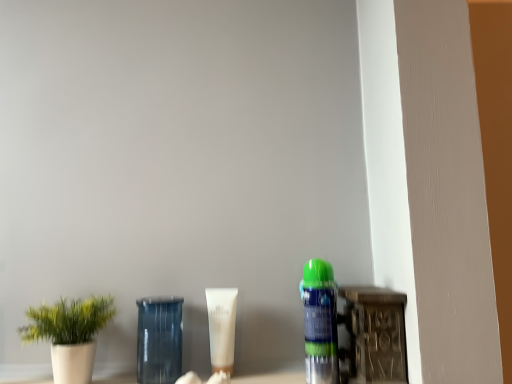
What is the approximate width of transparent glass jar at center?

The width of transparent glass jar at center is 8.79 centimeters.

Image resolution: width=512 pixels, height=384 pixels. What do you see at coordinates (320, 322) in the screenshot?
I see `green matte spray can at right` at bounding box center [320, 322].

Describe the element at coordinates (69, 334) in the screenshot. I see `white matte plant pot at left` at that location.

Identify the location of transparent glass jar at center. The image size is (512, 384). (159, 339).

From the picture: Is green matte spray can at right inside the boundaries of transparent glass jar at center, or outside?

green matte spray can at right cannot be found inside transparent glass jar at center.

From a real-world perspective, between green matte spray can at right and transparent glass jar at center, who is vertically higher?

From a 3D spatial view, green matte spray can at right is above.

Identify the location of glass vase lying on the left of green matte spray can at right. The height and width of the screenshot is (384, 512). (159, 339).

In the scene shown: Is green matte spray can at right taller than transparent glass jar at center?

Indeed, green matte spray can at right has a greater height compared to transparent glass jar at center.

Does white matte plant pot at left come in front of transparent glass jar at center?

Yes, it is.

Is white matte plant pot at left wider or thinner than transparent glass jar at center?

Considering their sizes, white matte plant pot at left looks broader than transparent glass jar at center.

Between white matte plant pot at left and transparent glass jar at center, which one appears on the right side from the viewer's perspective?

transparent glass jar at center is more to the right.

The width and height of the screenshot is (512, 384). Identify the location of glass vase that is on the right side of white matte plant pot at left. (159, 339).

Can green matte spray can at right be found inside white matte plant pot at left?

That's incorrect, green matte spray can at right is not inside white matte plant pot at left.

Which is behind, point (60, 320) or point (318, 258)?

The point (318, 258) is more distant.

Can you confirm if white matte plant pot at left is bigger than green matte spray can at right?

Yes, white matte plant pot at left is bigger than green matte spray can at right.

Is white matte plant pot at left next to green matte spray can at right?

No, white matte plant pot at left is not touching green matte spray can at right.

From their relative heights in the image, would you say transparent glass jar at center is taller or shorter than white matte plant pot at left?

Clearly, transparent glass jar at center is taller compared to white matte plant pot at left.

Is the position of transparent glass jar at center more distant than that of white matte plant pot at left?

Yes.

Can you confirm if transparent glass jar at center is positioned to the right of white matte plant pot at left?

Correct, you'll find transparent glass jar at center to the right of white matte plant pot at left.

Is transparent glass jar at center positioned beyond the bounds of white matte plant pot at left?

Yes, transparent glass jar at center is not within white matte plant pot at left.

Does white matte tube at center touch white matte plant pot at left?

There is a gap between white matte tube at center and white matte plant pot at left.

From the image's perspective, does white matte tube at center appear lower than white matte plant pot at left?

Incorrect, from the image's perspective, white matte tube at center is higher than white matte plant pot at left.

Is white matte tube at center at the right side of white matte plant pot at left?

Yes, white matte tube at center is to the right of white matte plant pot at left.

Which of these two, white matte tube at center or white matte plant pot at left, stands taller?

white matte plant pot at left is taller.

Is transparent glass jar at center with green matte spray can at right?

No, transparent glass jar at center is not beside green matte spray can at right.

Considering the positions of objects transparent glass jar at center and green matte spray can at right in the image provided, who is more to the right, transparent glass jar at center or green matte spray can at right?

From the viewer's perspective, green matte spray can at right appears more on the right side.

From a real-world perspective, is transparent glass jar at center located beneath green matte spray can at right?

Yes, from a real-world perspective, transparent glass jar at center is beneath green matte spray can at right.

Relative to transparent glass jar at center, is white matte tube at center in front or behind?

In the image, white matte tube at center appears behind transparent glass jar at center.

Where is `product on the right of transparent glass jar at center`? This screenshot has height=384, width=512. product on the right of transparent glass jar at center is located at coordinates (222, 327).

From the image's perspective, which object appears higher, white matte tube at center or transparent glass jar at center?

white matte tube at center.

Would you say white matte tube at center contains transparent glass jar at center?

No, transparent glass jar at center is not inside white matte tube at center.

What are the coordinates of `glass vase behind the green matte spray can at right` in the screenshot? It's located at (159, 339).

You are a GUI agent. You are given a task and a screenshot of the screen. Output one action in this format:
    pyautogui.click(x=<x>, y=<y>)
    Task: Click on the houseplant that is in front of the transparent glass jar at center
    
    Given the screenshot: What is the action you would take?
    pyautogui.click(x=69, y=334)

Looking at the image, which one is located closer to transparent glass jar at center, green matte spray can at right or white matte tube at center?

Among the two, white matte tube at center is located nearer to transparent glass jar at center.

When comparing their distances from transparent glass jar at center, does white matte tube at center or green matte spray can at right seem closer?

Result: white matte tube at center.

Estimate the real-world distances between objects in this image. Which object is further from white matte plant pot at left, green matte spray can at right or white matte tube at center?

The object further to white matte plant pot at left is green matte spray can at right.

When comparing their distances from green matte spray can at right, does white matte plant pot at left or transparent glass jar at center seem closer?

transparent glass jar at center is positioned closer to the anchor green matte spray can at right.

Estimate the real-world distances between objects in this image. Which object is closer to white matte plant pot at left, transparent glass jar at center or white matte tube at center?

Based on the image, transparent glass jar at center appears to be nearer to white matte plant pot at left.

Looking at the image, which one is located further to green matte spray can at right, white matte tube at center or transparent glass jar at center?

transparent glass jar at center is further to green matte spray can at right.

Based on their spatial positions, is white matte tube at center or white matte plant pot at left further from transparent glass jar at center?

The object further to transparent glass jar at center is white matte plant pot at left.

From the image, which object appears to be nearer to green matte spray can at right, white matte tube at center or white matte plant pot at left?

white matte tube at center.

The height and width of the screenshot is (384, 512). I want to click on glass vase between white matte plant pot at left and white matte tube at center in the horizontal direction, so click(159, 339).

This screenshot has height=384, width=512. Identify the location of glass vase between white matte plant pot at left and green matte spray can at right. (159, 339).

Locate an element on the screen. Image resolution: width=512 pixels, height=384 pixels. product between transparent glass jar at center and green matte spray can at right in the horizontal direction is located at coordinates (222, 327).

Find the location of a particular element. product between white matte plant pot at left and green matte spray can at right from left to right is located at coordinates (222, 327).